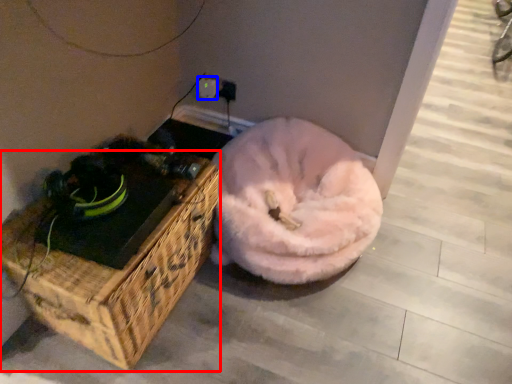
Question: Which of the following is the closest to the observer, furniture (highlighted by a red box) or electric outlet (highlighted by a blue box)?

Choices:
 (A) furniture
 (B) electric outlet

Answer: (A)